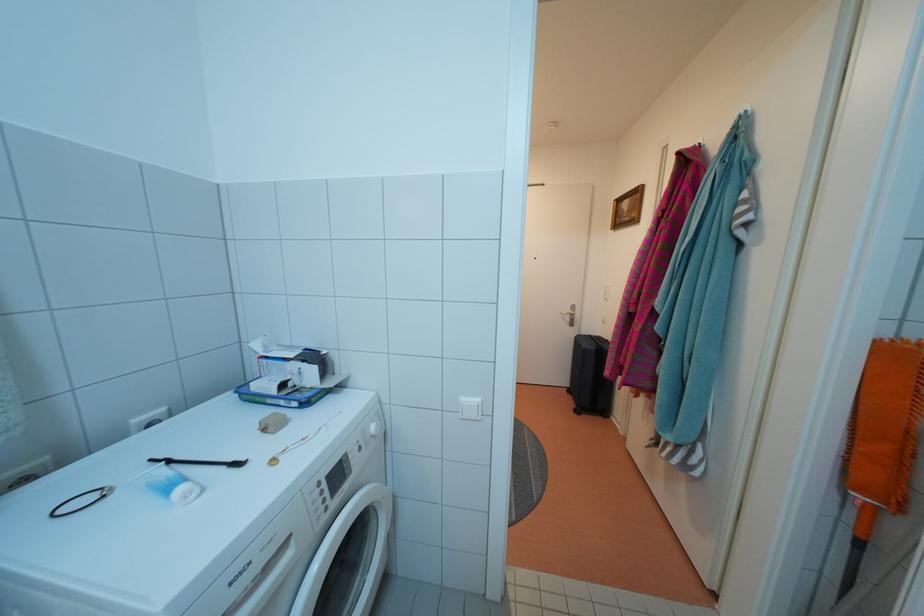
You are a GUI agent. You are given a task and a screenshot of the screen. Output one action in this format:
    pyautogui.click(x=<x>, y=<y>)
    Task: Click on the white light switch
    
    Given the screenshot: What is the action you would take?
    pyautogui.click(x=469, y=408)